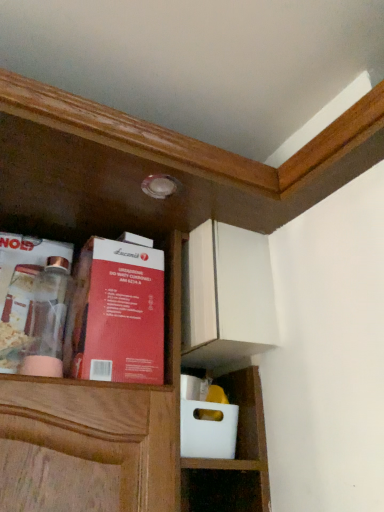
I want to click on red cardboard box at upper left, arranged as the 2th book when viewed from the left, so (119, 313).

This screenshot has height=512, width=384. Describe the element at coordinates (119, 313) in the screenshot. I see `red cardboard box at upper left, arranged as the 2th book when viewed from the left` at that location.

You are a GUI agent. You are given a task and a screenshot of the screen. Output one action in this format:
    pyautogui.click(x=<x>, y=<y>)
    Task: Click on the clear glass jar at left, which ranks as the 2th book in right-to-left order
    The height and width of the screenshot is (512, 384).
    Given the screenshot: What is the action you would take?
    pyautogui.click(x=23, y=289)

The width and height of the screenshot is (384, 512). What do you see at coordinates (23, 289) in the screenshot?
I see `clear glass jar at left, which ranks as the 2th book in right-to-left order` at bounding box center [23, 289].

Identify the location of red cardboard box at upper left, arranged as the 2th book when viewed from the left. The image size is (384, 512). (119, 313).

Is red cardboard box at upper left, arranged as the 2th book when viewed from the left, to the right of clear glass jar at left, which ranks as the 2th book in right-to-left order, from the viewer's perspective?

Indeed, red cardboard box at upper left, arranged as the 2th book when viewed from the left, is positioned on the right side of clear glass jar at left, which ranks as the 2th book in right-to-left order.

Is red cardboard box at upper left, arranged as the 2th book when viewed from the left, further to the viewer compared to clear glass jar at left, which ranks as the 2th book in right-to-left order?

No, it is not.

Is point (78, 361) behind point (31, 246)?

No.

From the image's perspective, which one is positioned lower, red cardboard box at upper left, arranged as the 2th book when viewed from the left, or clear glass jar at left, positioned as the 1th book in left-to-right order?

red cardboard box at upper left, arranged as the 2th book when viewed from the left, appears lower in the image.

From a real-world perspective, is red cardboard box at upper left, arranged as the 2th book when viewed from the left, on clear glass jar at left, positioned as the 1th book in left-to-right order?

No, from a real-world perspective, red cardboard box at upper left, arranged as the 2th book when viewed from the left, is not above clear glass jar at left, positioned as the 1th book in left-to-right order.

Which of these two, red cardboard box at upper left, arranged as the 2th book when viewed from the left, or clear glass jar at left, positioned as the 1th book in left-to-right order, is wider?

Wider between the two is red cardboard box at upper left, arranged as the 2th book when viewed from the left.

Considering the sizes of objects red cardboard box at upper left, the first book viewed from the right, and clear glass jar at left, positioned as the 1th book in left-to-right order, in the image provided, who is taller, red cardboard box at upper left, the first book viewed from the right, or clear glass jar at left, positioned as the 1th book in left-to-right order,?

red cardboard box at upper left, the first book viewed from the right, is taller.

Which of these two, red cardboard box at upper left, the first book viewed from the right, or clear glass jar at left, positioned as the 1th book in left-to-right order, is bigger?

red cardboard box at upper left, the first book viewed from the right, is bigger.

Looking at this image, is red cardboard box at upper left, the first book viewed from the right, positioned beyond the bounds of clear glass jar at left, positioned as the 1th book in left-to-right order?

Yes.

Does red cardboard box at upper left, arranged as the 2th book when viewed from the left, turn towards clear glass jar at left, which ranks as the 2th book in right-to-left order?

No, red cardboard box at upper left, arranged as the 2th book when viewed from the left, is not facing towards clear glass jar at left, which ranks as the 2th book in right-to-left order.

How different are the orientations of red cardboard box at upper left, arranged as the 2th book when viewed from the left, and clear glass jar at left, positioned as the 1th book in left-to-right order, in degrees?

The angle between the facing direction of red cardboard box at upper left, arranged as the 2th book when viewed from the left, and the facing direction of clear glass jar at left, positioned as the 1th book in left-to-right order, is 1.26 degrees.

The height and width of the screenshot is (512, 384). In order to click on book below the clear glass jar at left, which ranks as the 2th book in right-to-left order (from the image's perspective) in this screenshot , I will do point(119,313).

Between clear glass jar at left, which ranks as the 2th book in right-to-left order, and red cardboard box at upper left, arranged as the 2th book when viewed from the left, which one appears on the right side from the viewer's perspective?

red cardboard box at upper left, arranged as the 2th book when viewed from the left, is more to the right.

Does clear glass jar at left, which ranks as the 2th book in right-to-left order, come in front of red cardboard box at upper left, the first book viewed from the right?

No, clear glass jar at left, which ranks as the 2th book in right-to-left order, is further to the viewer.

Between point (34, 249) and point (102, 255), which one is positioned behind?

Point (34, 249)

From the image's perspective, would you say clear glass jar at left, positioned as the 1th book in left-to-right order, is positioned over red cardboard box at upper left, arranged as the 2th book when viewed from the left?

Indeed, from the image's perspective, clear glass jar at left, positioned as the 1th book in left-to-right order, is shown above red cardboard box at upper left, arranged as the 2th book when viewed from the left.

From a real-world perspective, which is physically above, clear glass jar at left, positioned as the 1th book in left-to-right order, or red cardboard box at upper left, the first book viewed from the right?

clear glass jar at left, positioned as the 1th book in left-to-right order.

Considering the relative sizes of clear glass jar at left, which ranks as the 2th book in right-to-left order, and red cardboard box at upper left, arranged as the 2th book when viewed from the left, in the image provided, is clear glass jar at left, which ranks as the 2th book in right-to-left order, wider than red cardboard box at upper left, arranged as the 2th book when viewed from the left,?

Incorrect, the width of clear glass jar at left, which ranks as the 2th book in right-to-left order, does not surpass that of red cardboard box at upper left, arranged as the 2th book when viewed from the left.

Who is taller, clear glass jar at left, which ranks as the 2th book in right-to-left order, or red cardboard box at upper left, arranged as the 2th book when viewed from the left?

red cardboard box at upper left, arranged as the 2th book when viewed from the left, is taller.

In terms of size, does clear glass jar at left, which ranks as the 2th book in right-to-left order, appear bigger or smaller than red cardboard box at upper left, the first book viewed from the right?

clear glass jar at left, which ranks as the 2th book in right-to-left order, is smaller than red cardboard box at upper left, the first book viewed from the right.

Is red cardboard box at upper left, arranged as the 2th book when viewed from the left, completely or partially inside clear glass jar at left, which ranks as the 2th book in right-to-left order?

Actually, red cardboard box at upper left, arranged as the 2th book when viewed from the left, is outside clear glass jar at left, which ranks as the 2th book in right-to-left order.

Is clear glass jar at left, which ranks as the 2th book in right-to-left order, with red cardboard box at upper left, the first book viewed from the right?

No, clear glass jar at left, which ranks as the 2th book in right-to-left order, is not making contact with red cardboard box at upper left, the first book viewed from the right.

Is clear glass jar at left, which ranks as the 2th book in right-to-left order, aimed at red cardboard box at upper left, arranged as the 2th book when viewed from the left?

No, clear glass jar at left, which ranks as the 2th book in right-to-left order, is not facing towards red cardboard box at upper left, arranged as the 2th book when viewed from the left.

What's the angular difference between clear glass jar at left, positioned as the 1th book in left-to-right order, and red cardboard box at upper left, arranged as the 2th book when viewed from the left,'s facing directions?

The facing directions of clear glass jar at left, positioned as the 1th book in left-to-right order, and red cardboard box at upper left, arranged as the 2th book when viewed from the left, are 1.26 degrees apart.

You are a GUI agent. You are given a task and a screenshot of the screen. Output one action in this format:
    pyautogui.click(x=<x>, y=<y>)
    Task: Click on the book that is on the right side of clear glass jar at left, which ranks as the 2th book in right-to-left order
    The height and width of the screenshot is (512, 384).
    Given the screenshot: What is the action you would take?
    pyautogui.click(x=119, y=313)

Where is `book that is on the right side of clear glass jar at left, which ranks as the 2th book in right-to-left order`? book that is on the right side of clear glass jar at left, which ranks as the 2th book in right-to-left order is located at coordinates (119, 313).

Locate an element on the screen. book lying on the left of red cardboard box at upper left, arranged as the 2th book when viewed from the left is located at coordinates (23, 289).